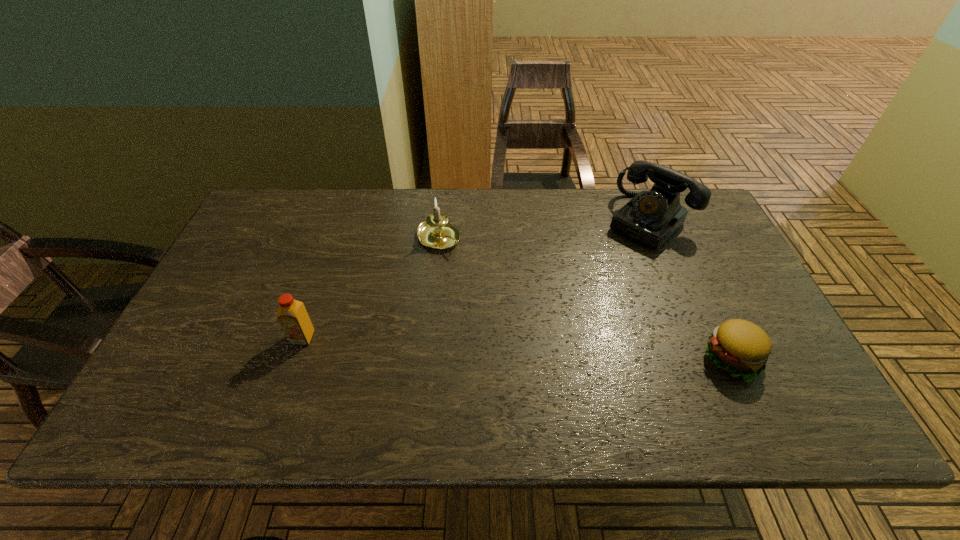
Locate an element on the screen. free space at the near edge of the desktop is located at coordinates (492, 384).

Where is `vacant space at the left edge of the desktop`? This screenshot has height=540, width=960. vacant space at the left edge of the desktop is located at coordinates (266, 235).

You are a GUI agent. You are given a task and a screenshot of the screen. Output one action in this format:
    pyautogui.click(x=<x>, y=<y>)
    Task: Click on the vacant region at the right edge of the desktop
    
    Given the screenshot: What is the action you would take?
    pyautogui.click(x=743, y=281)

In the image, there is a desktop. Where is `blank space at the far left corner`? This screenshot has height=540, width=960. blank space at the far left corner is located at coordinates (276, 213).

Find the location of a particular element. free point between the candle holder and the leftmost object is located at coordinates (371, 288).

You are a GUI agent. You are given a task and a screenshot of the screen. Output one action in this format:
    pyautogui.click(x=<x>, y=<y>)
    Task: Click on the empty space between the orange juice and the telephone
    The height and width of the screenshot is (540, 960).
    Given the screenshot: What is the action you would take?
    pyautogui.click(x=475, y=280)

I want to click on vacant space that's between the orange juice and the candle holder, so click(x=371, y=288).

Locate an element on the screen. This screenshot has width=960, height=540. vacant point located between the leftmost object and the third object from right to left is located at coordinates (371, 288).

Where is `free spot between the candle holder and the tallest object`? Image resolution: width=960 pixels, height=540 pixels. free spot between the candle holder and the tallest object is located at coordinates (543, 230).

At what (x,y) coordinates should I click in order to perform the action: click on free space between the orange juice and the hamburger. Please return your answer as a coordinate pair (x, y). The image size is (960, 540). Looking at the image, I should click on (518, 348).